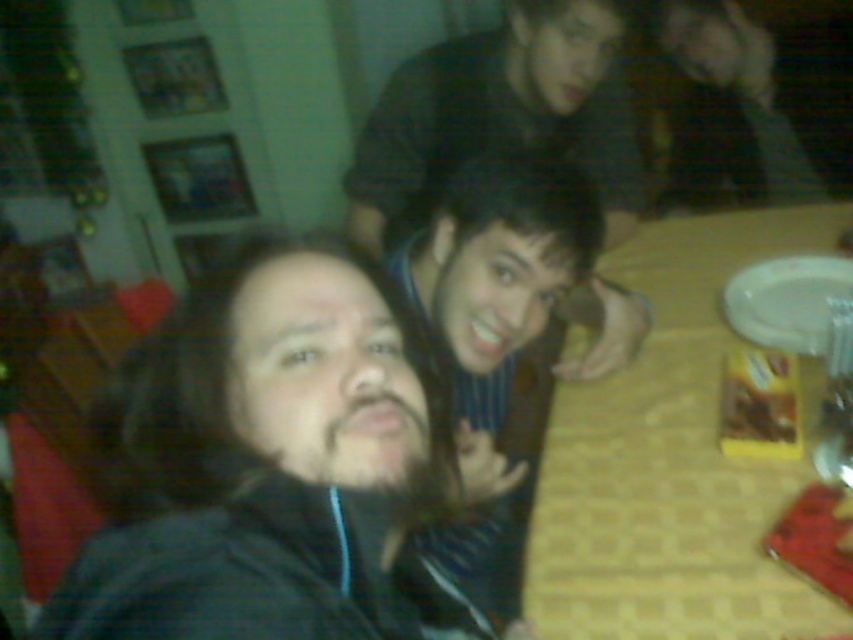
Question: Which object is positioned farthest from the shiny blue shirt at center?

Choices:
 (A) yellow fabric table at lower right
 (B) white glossy plate at right
 (C) striped shirt at center
 (D) matte black hair at center

Answer: (C)

Question: Does yellow fabric table at lower right appear on the right side of white glossy plate at right?

Choices:
 (A) no
 (B) yes

Answer: (A)

Question: In this image, where is matte black hair at center located relative to yellow fabric table at lower right?

Choices:
 (A) below
 (B) above

Answer: (A)

Question: Estimate the real-world distances between objects in this image. Which object is farther from the shiny blue shirt at center?

Choices:
 (A) white glossy plate at right
 (B) matte black hair at center

Answer: (A)

Question: Which object is the closest to the white glossy plate at right?

Choices:
 (A) shiny blue shirt at center
 (B) yellow fabric table at lower right
 (C) striped shirt at center

Answer: (B)

Question: Can you confirm if matte black hair at center is bigger than white glossy plate at right?

Choices:
 (A) no
 (B) yes

Answer: (B)